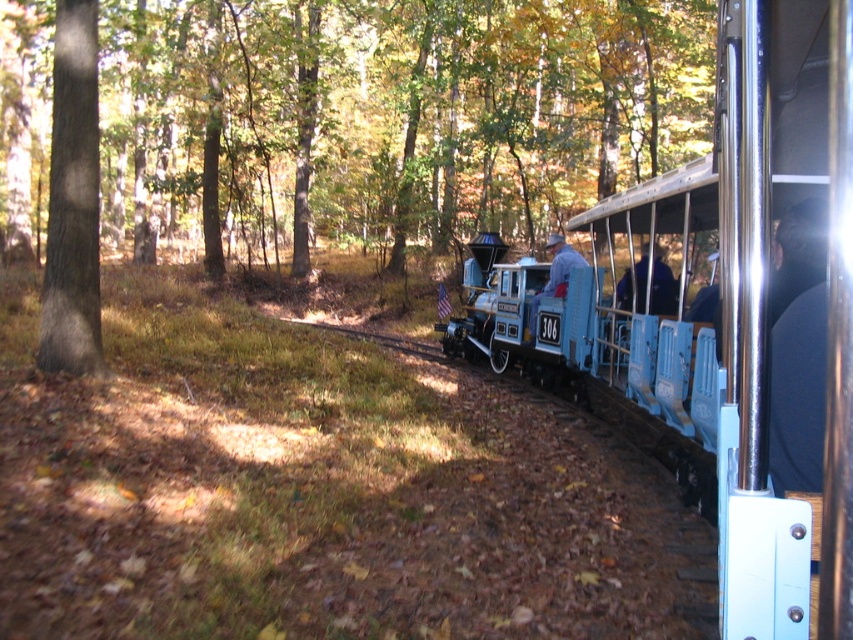
Question: Estimate the real-world distances between objects in this image. Which object is farther from the smooth gray bark at left?

Choices:
 (A) blue painted wood train car at center
 (B) denim jacket at center
 (C) blue fabric at center

Answer: (A)

Question: Is blue fabric at center positioned behind denim jacket at center?

Choices:
 (A) yes
 (B) no

Answer: (B)

Question: Considering the real-world distances, which object is farthest from the blue painted wood train car at center?

Choices:
 (A) smooth gray bark at left
 (B) blue fabric at center

Answer: (A)

Question: Can you confirm if smooth gray bark at left is wider than blue fabric at center?

Choices:
 (A) yes
 (B) no

Answer: (A)

Question: Does brown wood tree at center appear on the left side of denim jacket at center?

Choices:
 (A) yes
 (B) no

Answer: (A)

Question: Which point is closer to the camera?

Choices:
 (A) blue painted wood train car at center
 (B) blue plastic train at center
 (C) denim jacket at center
 (D) brown wood tree at center

Answer: (B)